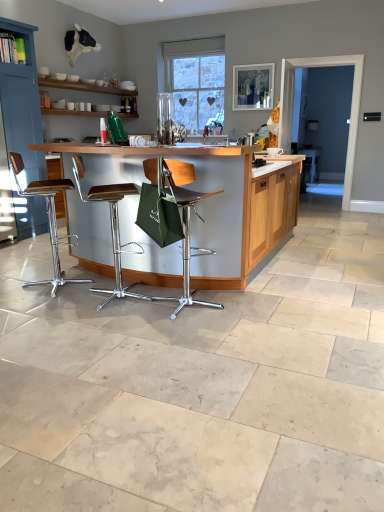
Find the location of a particular element. Image resolution: width=384 pixels, height=512 pixels. free space in front of green fabric chair at center, the 3th chair in the left-to-right sequence is located at coordinates (183, 333).